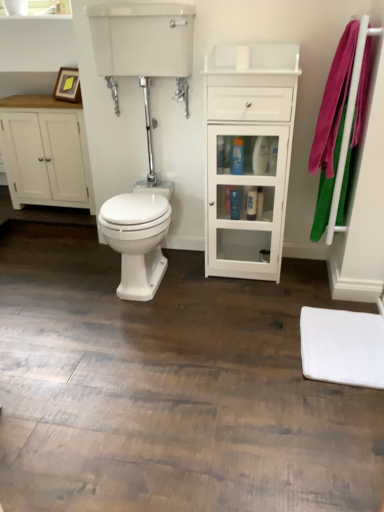
Where is `free space in front of white glossy cabinet at center`? This screenshot has height=512, width=384. free space in front of white glossy cabinet at center is located at coordinates (243, 298).